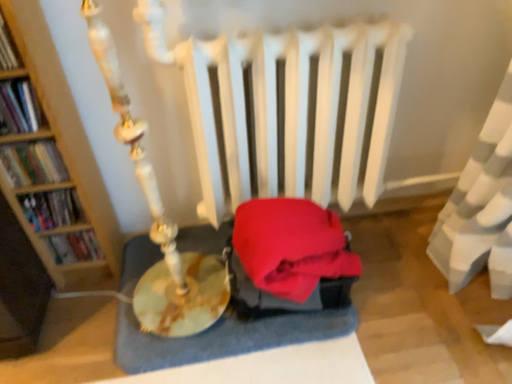
This screenshot has height=384, width=512. What do you see at coordinates (8, 48) in the screenshot?
I see `hardcover book at upper left, the fifth book in the bottom-to-top sequence` at bounding box center [8, 48].

What is the approximate height of hardcover book at upper left, which is counted as the 1th book, starting from the top?

5.32 inches.

You are a GUI agent. You are given a task and a screenshot of the screen. Output one action in this format:
    pyautogui.click(x=<x>, y=<y>)
    Task: Click on the hardcover book at left, the 4th book ordered from the bottom
    This screenshot has height=384, width=512.
    Given the screenshot: What is the action you would take?
    pyautogui.click(x=18, y=107)

In order to click on wooden bookshelf at left, placed as the 3th book when sorted from top to bottom in this screenshot , I will do point(33,163).

Find the location of a particular element. This screenshot has height=384, width=512. hardcover book at upper left, which is counted as the 1th book, starting from the top is located at coordinates (8, 48).

From the image's perspective, which is below, wooden bookshelf at left, arranged as the 3th book when ordered from the bottom, or hardcover book at left, positioned as the 2th book in bottom-to-top order?

From the image's view, hardcover book at left, positioned as the 2th book in bottom-to-top order, is below.

What's the angular difference between wooden bookshelf at left, arranged as the 3th book when ordered from the bottom, and hardcover book at left, positioned as the 2th book in bottom-to-top order,'s facing directions?

There is a 0-degree angle between the facing directions of wooden bookshelf at left, arranged as the 3th book when ordered from the bottom, and hardcover book at left, positioned as the 2th book in bottom-to-top order.

Is wooden bookshelf at left, arranged as the 3th book when ordered from the bottom, not close to hardcover book at left, positioned as the 2th book in bottom-to-top order?

No, wooden bookshelf at left, arranged as the 3th book when ordered from the bottom, is not far from hardcover book at left, positioned as the 2th book in bottom-to-top order.

How much distance is there between wooden bookshelf at left, placed as the 3th book when sorted from top to bottom, and hardcover book at left, positioned as the 2th book in bottom-to-top order?

wooden bookshelf at left, placed as the 3th book when sorted from top to bottom, is 3.76 inches away from hardcover book at left, positioned as the 2th book in bottom-to-top order.

Who is shorter, hardcover book at left, the 4th book ordered from the bottom, or hardcover book at left, which is the 1th book from bottom to top?

hardcover book at left, the 4th book ordered from the bottom.

Is point (0, 97) positioned before point (60, 237)?

Yes, it is in front of point (60, 237).

At what (x,y) coordinates should I click in order to perform the action: click on book that is the 3rd one above the hardcover book at left, which is the 1th book from bottom to top (from a real-world perspective). Please return your answer as a coordinate pair (x, y). Looking at the image, I should click on pyautogui.click(x=18, y=107).

Could you tell me if hardcover book at left, the 2th book in the top-to-bottom sequence, is turned towards hardcover book at left, which is the 1th book from bottom to top?

No, hardcover book at left, the 2th book in the top-to-bottom sequence, is not oriented towards hardcover book at left, which is the 1th book from bottom to top.

Is hardcover book at upper left, which is counted as the 1th book, starting from the top, wider than wooden bookshelf at left, placed as the 3th book when sorted from top to bottom?

In fact, hardcover book at upper left, which is counted as the 1th book, starting from the top, might be narrower than wooden bookshelf at left, placed as the 3th book when sorted from top to bottom.

From a real-world perspective, who is located higher, hardcover book at upper left, the fifth book in the bottom-to-top sequence, or wooden bookshelf at left, arranged as the 3th book when ordered from the bottom?

In real-world perspective, hardcover book at upper left, the fifth book in the bottom-to-top sequence, is above.

Between hardcover book at upper left, the fifth book in the bottom-to-top sequence, and wooden bookshelf at left, placed as the 3th book when sorted from top to bottom, which one appears on the left side from the viewer's perspective?

From the viewer's perspective, hardcover book at upper left, the fifth book in the bottom-to-top sequence, appears more on the left side.

Choose the correct answer: Is velvet red cushion at center inside wooden bookshelf at left, arranged as the 3th book when ordered from the bottom, or outside it?

velvet red cushion at center is not enclosed by wooden bookshelf at left, arranged as the 3th book when ordered from the bottom.

Can you tell me how much velvet red cushion at center and wooden bookshelf at left, placed as the 3th book when sorted from top to bottom, differ in facing direction?

There is a 0.000621-degree angle between the facing directions of velvet red cushion at center and wooden bookshelf at left, placed as the 3th book when sorted from top to bottom.

Which of these two, velvet red cushion at center or wooden bookshelf at left, arranged as the 3th book when ordered from the bottom, stands taller?

Standing taller between the two is wooden bookshelf at left, arranged as the 3th book when ordered from the bottom.

From a real-world perspective, is hardcover book at left, which is the 1th book from bottom to top, beneath hardcover book at left, the 2th book in the top-to-bottom sequence?

Yes, from a real-world perspective, hardcover book at left, which is the 1th book from bottom to top, is below hardcover book at left, the 2th book in the top-to-bottom sequence.

Does hardcover book at left, which is the 1th book from bottom to top, lie in front of hardcover book at left, the 4th book ordered from the bottom?

No.

From a real-world perspective, relative to hardcover book at left, the 4th book ordered from the bottom, is hardcover book at left, the fourth book positioned from the top, vertically above or below?

In terms of real-world spatial position, hardcover book at left, the fourth book positioned from the top, is below hardcover book at left, the 4th book ordered from the bottom.

Is point (58, 226) closer or farther from the camera than point (13, 96)?

Point (58, 226) is positioned farther from the camera compared to point (13, 96).

From the image's perspective, which object appears higher, hardcover book at left, the fourth book positioned from the top, or hardcover book at left, the 4th book ordered from the bottom?

hardcover book at left, the 4th book ordered from the bottom, from the image's perspective.

Locate an element on the screen. The height and width of the screenshot is (384, 512). furniture below the hardcover book at left, the 2th book in the top-to-bottom sequence (from the image's perspective) is located at coordinates (226, 337).

Does point (155, 358) lie behind point (11, 124)?

Yes, point (155, 358) is behind point (11, 124).

Can you confirm if velvet red cushion at center is wider than hardcover book at left, the 4th book ordered from the bottom?

Yes, velvet red cushion at center is wider than hardcover book at left, the 4th book ordered from the bottom.

Is velvet red cushion at center looking in the opposite direction of hardcover book at left, the 4th book ordered from the bottom?

No, velvet red cushion at center is not facing the opposite direction of hardcover book at left, the 4th book ordered from the bottom.

Find the location of a particular element. This screenshot has width=512, height=384. book that is the 1st one above the hardcover book at left, positioned as the 2th book in bottom-to-top order (from a real-world perspective) is located at coordinates coord(33,163).

This screenshot has width=512, height=384. I want to click on book that is the 3rd one when counting leftward from the hardcover book at left, which is the 1th book from bottom to top, so click(x=18, y=107).

From the image, which object appears to be farther from hardcover book at left, the 4th book ordered from the bottom, hardcover book at upper left, the fifth book in the bottom-to-top sequence, or wooden bookshelf at left, placed as the 3th book when sorted from top to bottom?

wooden bookshelf at left, placed as the 3th book when sorted from top to bottom, is positioned further to the anchor hardcover book at left, the 4th book ordered from the bottom.

Based on the photo, which object lies further to the anchor point hardcover book at left, the 2th book in the top-to-bottom sequence, hardcover book at upper left, the fifth book in the bottom-to-top sequence, or hardcover book at left, positioned as the 2th book in bottom-to-top order?

Among the two, hardcover book at left, positioned as the 2th book in bottom-to-top order, is located further to hardcover book at left, the 2th book in the top-to-bottom sequence.

In the scene shown: When comparing their distances from wooden bookshelf at left, arranged as the 3th book when ordered from the bottom, does velvet red cushion at center or hardcover book at left, positioned as the 2th book in bottom-to-top order, seem further?

velvet red cushion at center lies further to wooden bookshelf at left, arranged as the 3th book when ordered from the bottom, than the other object.

From the image, which object appears to be farther from wooden bookshelf at left, placed as the 3th book when sorted from top to bottom, hardcover book at left, the 4th book ordered from the bottom, or hardcover book at left, positioned as the 2th book in bottom-to-top order?

hardcover book at left, the 4th book ordered from the bottom, is positioned further to the anchor wooden bookshelf at left, placed as the 3th book when sorted from top to bottom.

Estimate the real-world distances between objects in this image. Which object is further from hardcover book at left, the 4th book ordered from the bottom, hardcover book at left, which is counted as the 5th book, starting from the top, or wooden bookshelf at left, arranged as the 3th book when ordered from the bottom?

The object further to hardcover book at left, the 4th book ordered from the bottom, is hardcover book at left, which is counted as the 5th book, starting from the top.

Estimate the real-world distances between objects in this image. Which object is further from wooden bookshelf at left, placed as the 3th book when sorted from top to bottom, velvet red cushion at center or hardcover book at left, the 2th book in the top-to-bottom sequence?

Among the two, velvet red cushion at center is located further to wooden bookshelf at left, placed as the 3th book when sorted from top to bottom.

Looking at the image, which one is located further to wooden bookshelf at left, arranged as the 3th book when ordered from the bottom, hardcover book at upper left, which is counted as the 1th book, starting from the top, or hardcover book at left, the fourth book positioned from the top?

The object further to wooden bookshelf at left, arranged as the 3th book when ordered from the bottom, is hardcover book at upper left, which is counted as the 1th book, starting from the top.

Which object lies nearer to the anchor point velvet red cushion at center, wooden bookshelf at left, placed as the 3th book when sorted from top to bottom, or hardcover book at upper left, which is counted as the 1th book, starting from the top?

wooden bookshelf at left, placed as the 3th book when sorted from top to bottom, is closer to velvet red cushion at center.

The image size is (512, 384). I want to click on book between hardcover book at left, the 4th book ordered from the bottom, and hardcover book at left, positioned as the 2th book in bottom-to-top order, from top to bottom, so click(x=33, y=163).

Find the location of `book that lies between wooden bookshelf at left, arranged as the 3th book when ordered from the bottom, and hardcover book at left, which is the 1th book from bottom to top, from top to bottom`. book that lies between wooden bookshelf at left, arranged as the 3th book when ordered from the bottom, and hardcover book at left, which is the 1th book from bottom to top, from top to bottom is located at coordinates (52, 209).

You are a GUI agent. You are given a task and a screenshot of the screen. Output one action in this format:
    pyautogui.click(x=<x>, y=<y>)
    Task: Click on the book that lies between hardcover book at upper left, the fifth book in the bottom-to-top sequence, and wooden bookshelf at left, arranged as the 3th book when ordered from the bottom, from top to bottom
    This screenshot has width=512, height=384.
    Given the screenshot: What is the action you would take?
    pyautogui.click(x=18, y=107)

The height and width of the screenshot is (384, 512). What are the coordinates of `book situated between hardcover book at left, the fourth book positioned from the top, and velvet red cushion at center from left to right` in the screenshot? It's located at coord(74,247).